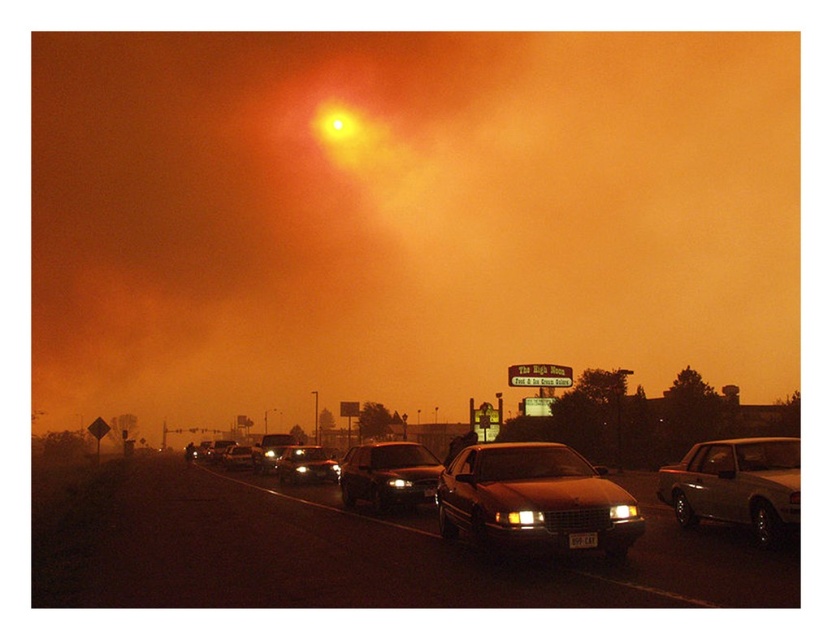
You are standing at the camera position observing the scene. A drone is flying towards the point at coordinates point (312, 461). If the drone can travel 5 meters per second, how many seconds will it take for the drone to reach that point?

The distance of point (312, 461) from camera is 31.31 meters. At a speed of 5 meters per second, the drone will take 31.31 divided by 5 equals approximately 6.26 seconds to reach the point.

You are a driver trying to navigate through the thick haze caused by the dust storm. You notice the matte glass sun at upper center and the black plastic license plate at lower center in your view. Which object is located to the left of the other?

The matte glass sun at upper center is positioned on the left side of black plastic license plate at lower center.

You are a pedestrian standing on the side of the road in this scene. You need to cross the road to reach a store across. The road is busy with traffic, including the smokey metallic car at center and the shiny silver sedan at center. Given that the distance between these two vehicles is 9.52 meters, can you safely cross the road between them without getting hit?

The distance between the smokey metallic car at center and the shiny silver sedan at center is 9.52 meters. Since this distance is sufficient for a pedestrian to cross safely, assuming the vehicles remain stationary or moving slowly, you can cross between them without getting hit.